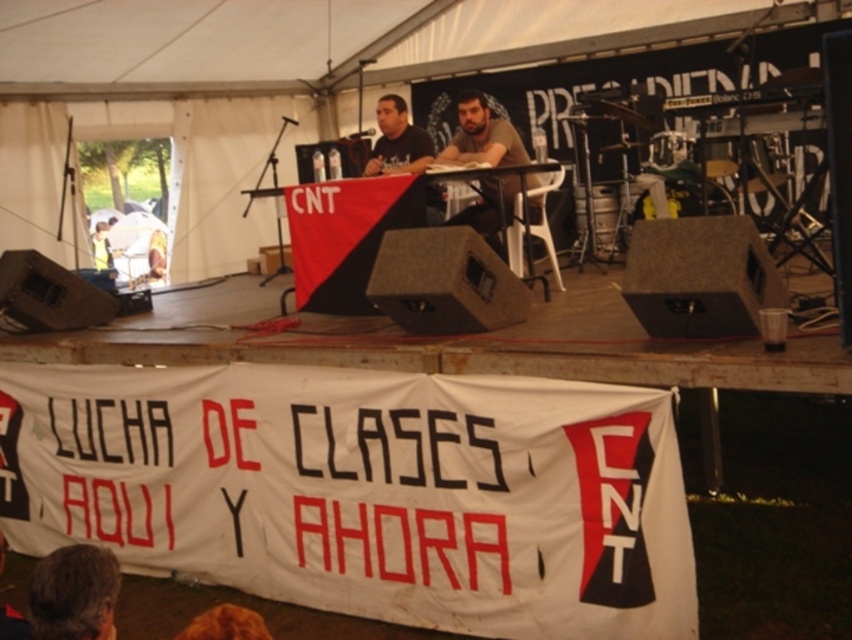
Can you confirm if brown hair at lower left is positioned to the left of black t-shirt at center?

Correct, you'll find brown hair at lower left to the left of black t-shirt at center.

Between point (70, 556) and point (392, 118), which one is positioned behind?

Point (392, 118)

Identify the location of brown hair at lower left. (73, 593).

Does brown fur at lower center have a greater height compared to dark brown leather jacket at lower left?

No, brown fur at lower center is not taller than dark brown leather jacket at lower left.

Who is shorter, brown fur at lower center or dark brown leather jacket at lower left?

Standing shorter between the two is brown fur at lower center.

Locate an element on the screen. The width and height of the screenshot is (852, 640). brown fur at lower center is located at coordinates (225, 625).

Is brown matte shirt at center shorter than brown fur at lower center?

No.

How far apart are brown matte shirt at center and brown fur at lower center?

brown matte shirt at center and brown fur at lower center are 4.26 meters apart.

Who is more forward, [498,221] or [243,636]?

Point [243,636]

This screenshot has height=640, width=852. Find the location of `brown matte shirt at center`. brown matte shirt at center is located at coordinates (481, 136).